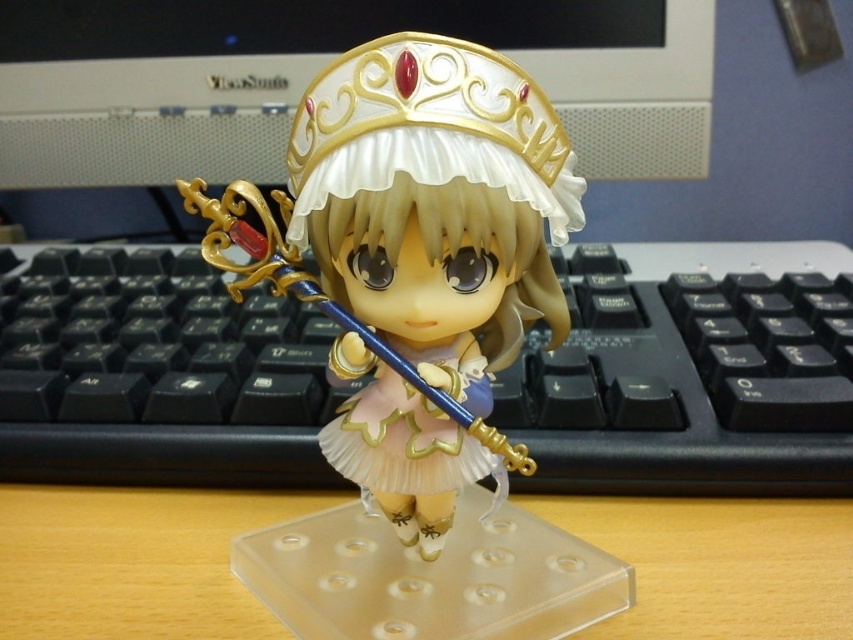
Who is more forward, (453, 196) or (618, 115)?

Point (453, 196)

Is matte gold crown at center wider than white glossy crown at upper center?

Incorrect, matte gold crown at center's width does not surpass white glossy crown at upper center's.

Between point (503, 76) and point (676, 65), which one is positioned behind?

Positioned behind is point (676, 65).

The width and height of the screenshot is (853, 640). In order to click on matte gold crown at center in this screenshot , I will do `click(419, 205)`.

Between white glossy crown at upper center and wooden desk at center, which one is positioned lower?

Positioned lower is wooden desk at center.

Is white glossy crown at upper center positioned behind wooden desk at center?

Yes, white glossy crown at upper center is behind wooden desk at center.

Describe the element at coordinates (149, 115) in the screenshot. I see `white glossy crown at upper center` at that location.

Locate an element on the screen. The height and width of the screenshot is (640, 853). white glossy crown at upper center is located at coordinates (149, 115).

Between black plastic keyboard at center and matte gold crown at center, which one is positioned lower?

matte gold crown at center is lower down.

Between point (566, 440) and point (416, 426), which one is positioned in front?

Point (416, 426) is more forward.

Find the location of a particular element. The image size is (853, 640). black plastic keyboard at center is located at coordinates (691, 372).

What are the coordinates of `black plastic keyboard at center` in the screenshot? It's located at (691, 372).